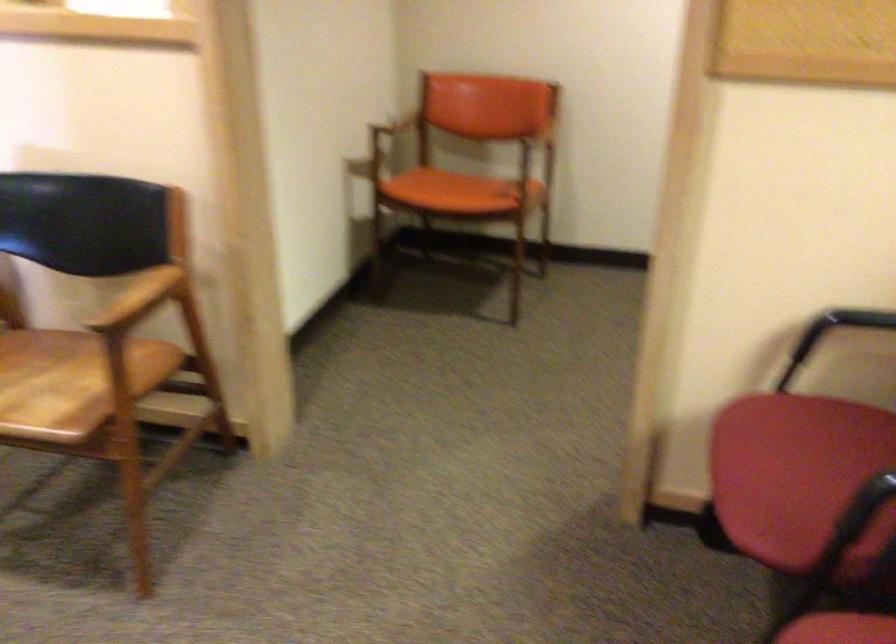
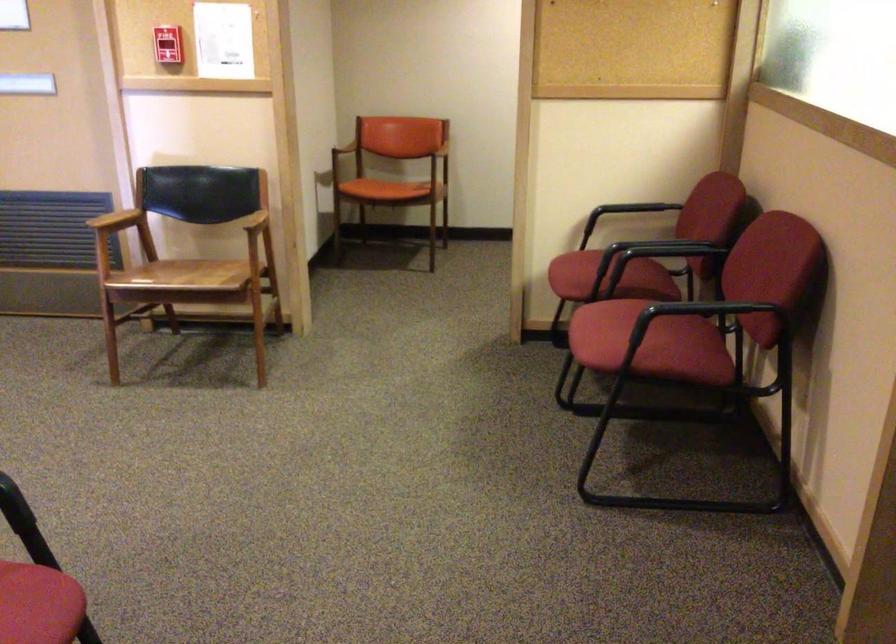
Find the pixel in the second image that matches point 441,201 in the first image.

(383, 189)